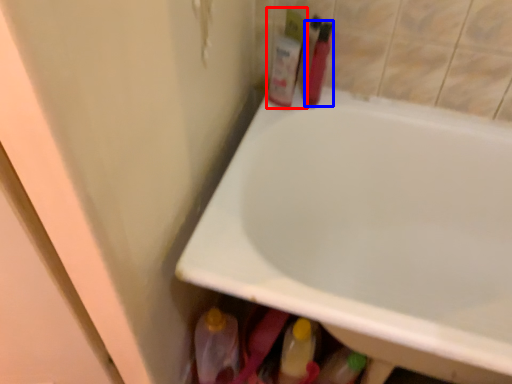
Question: Among these objects, which one is nearest to the camera, toiletry (highlighted by a red box) or toiletry (highlighted by a blue box)?

Choices:
 (A) toiletry
 (B) toiletry

Answer: (B)